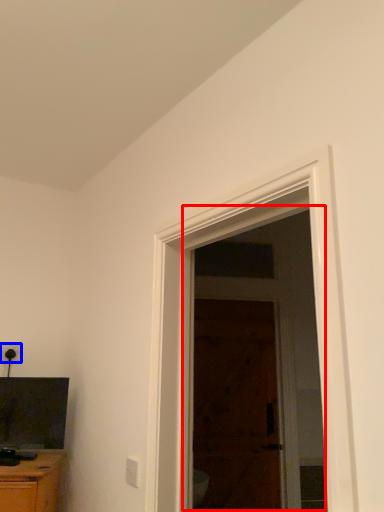
Question: Which object is closer to the camera taking this photo, screen door (highlighted by a red box) or electric outlet (highlighted by a blue box)?

Choices:
 (A) screen door
 (B) electric outlet

Answer: (B)